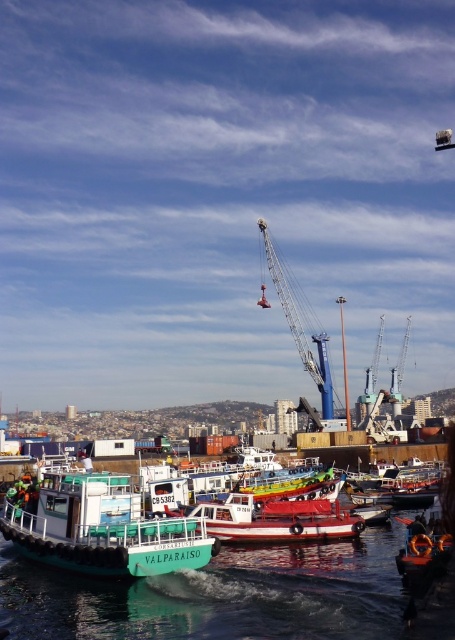
You are a crane operator who needs to lift a container from the white glossy boat at center. Considering the size of the blue metallic crane at center, can the crane safely lift the container from the boat?

The white glossy boat at center is smaller than the blue metallic crane at center, so the crane is larger and likely has sufficient capacity to safely lift the container from the boat.

You are standing at the point marked by coordinates (x=218, y=595) in the harbor scene. What object are you standing on?

You are standing on the green rubber boat at lower left marked by the point (x=218, y=595).

You are a harbor worker who needs to guide a new boat to the docking area. You see the white glossy boat at center and the blue metallic crane at center. Which direction should the new boat go to avoid the crane?

The white glossy boat at center is to the left of the blue metallic crane at center, so the new boat should go to the right to avoid the crane.